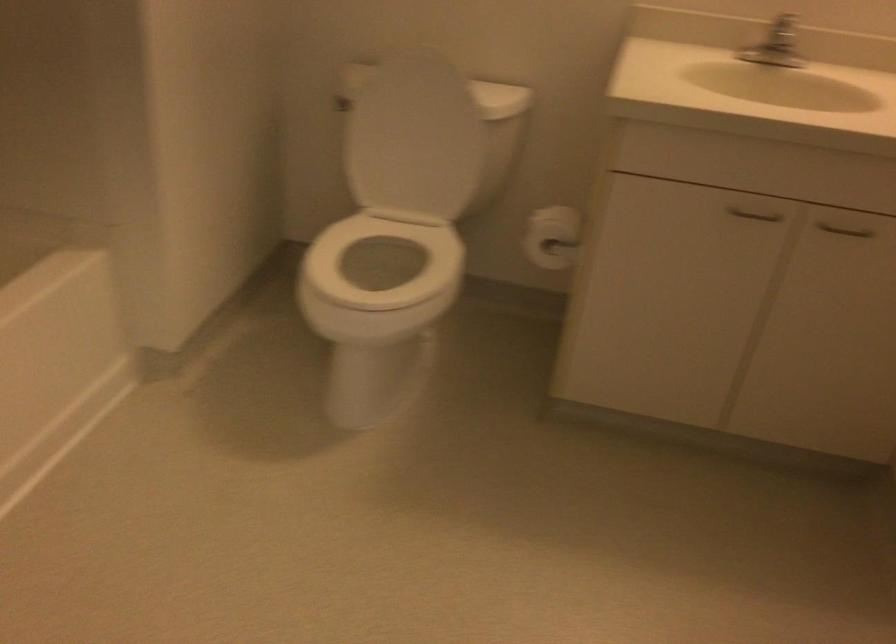
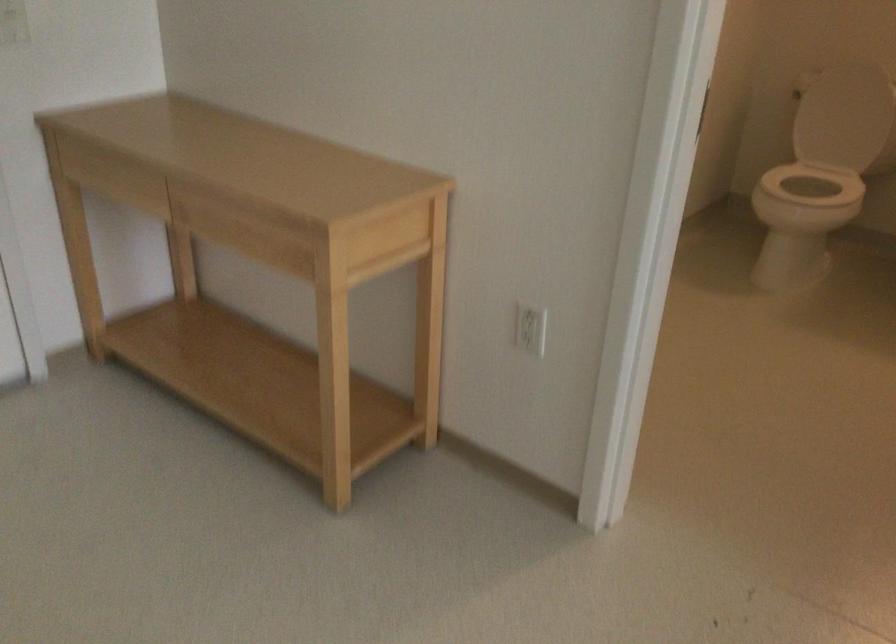
Question: I am providing you with two images of the same scene from different viewpoints. Please identify which objects are invisible in image2.

Choices:
 (A) white toilet lid
 (B) metal towel ring
 (C) toilet flush handle
 (D) white toilet seat

Answer: (C)